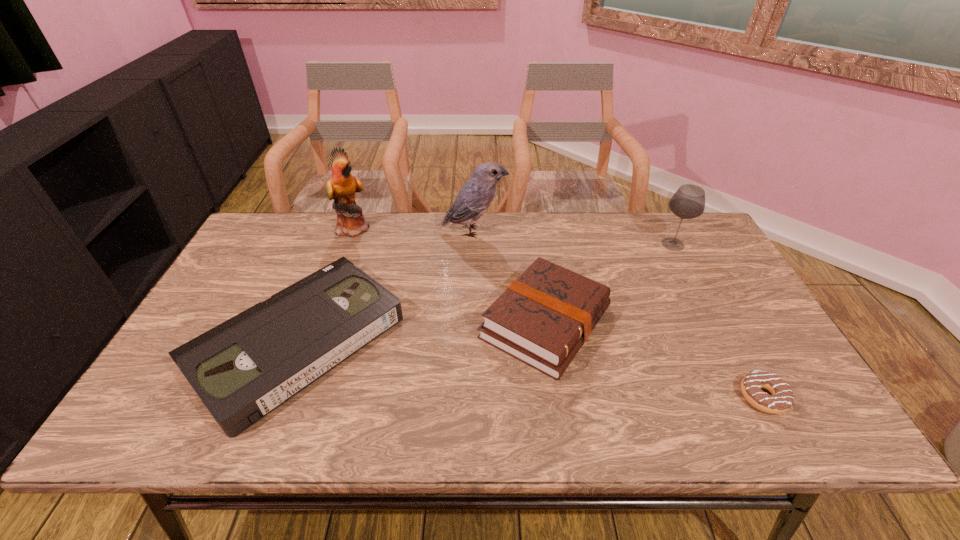
Identify the location of object present at the near left corner. (244, 368).

The image size is (960, 540). I want to click on object present at the far right corner, so click(x=688, y=202).

Identify the location of object that is positioned at the near right corner. This screenshot has height=540, width=960. (782, 397).

The image size is (960, 540). I want to click on blank space at the far edge, so click(569, 252).

Identify the location of vacant space at the left edge of the desktop. Image resolution: width=960 pixels, height=540 pixels. (281, 275).

Identify the location of vacant space at the right edge of the desktop. The image size is (960, 540). (731, 320).

You are a GUI agent. You are given a task and a screenshot of the screen. Output one action in this format:
    pyautogui.click(x=<x>, y=<y>)
    Task: Click on the vacant region at the far left corner of the desktop
    The width and height of the screenshot is (960, 540).
    Given the screenshot: What is the action you would take?
    pyautogui.click(x=302, y=234)

The width and height of the screenshot is (960, 540). Identify the location of free space between the second shortest object and the shortest object. (531, 369).

The width and height of the screenshot is (960, 540). Identify the location of vacant area that lies between the hardback book and the shortest object. (655, 360).

Locate an element on the screen. free area in between the wineglass and the taller parrot is located at coordinates (514, 236).